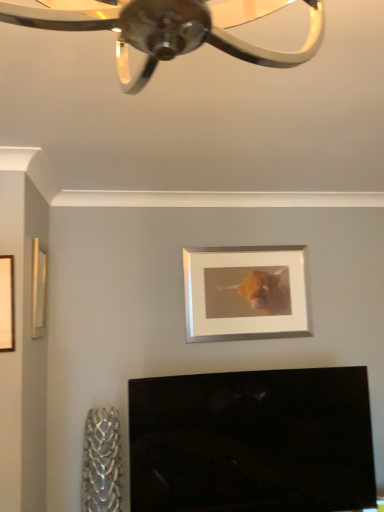
Question: Could you tell me if white matte picture frame at upper center, placed as the 3th picture frame when sorted from left to right, is turned towards wooden frame at left, acting as the 2th picture frame starting from the left?

Choices:
 (A) no
 (B) yes

Answer: (A)

Question: From the image's perspective, is white matte picture frame at upper center, the first picture frame from the right, below wooden frame at left, the 2th picture frame positioned from the front?

Choices:
 (A) no
 (B) yes

Answer: (B)

Question: Does white matte picture frame at upper center, the first picture frame from the right, appear on the right side of wooden frame at left, which is the second picture frame from right to left?

Choices:
 (A) yes
 (B) no

Answer: (A)

Question: From a real-world perspective, does white matte picture frame at upper center, placed as the 3th picture frame when sorted from left to right, stand above wooden frame at left, acting as the 2th picture frame starting from the left?

Choices:
 (A) yes
 (B) no

Answer: (B)

Question: From a real-world perspective, is white matte picture frame at upper center, which is the 1th picture frame from back to front, below wooden frame at left, the 2th picture frame positioned from the front?

Choices:
 (A) yes
 (B) no

Answer: (A)

Question: In the image, is wooden frame at left, placed as the 3th picture frame when sorted from back to front, on the left side or the right side of wooden frame at left, the 2th picture frame positioned from the front?

Choices:
 (A) left
 (B) right

Answer: (A)

Question: Relative to wooden frame at left, which is the second picture frame from right to left, is wooden frame at left, marked as the 1th picture frame in a front-to-back arrangement, in front or behind?

Choices:
 (A) behind
 (B) front

Answer: (B)

Question: Is wooden frame at left, marked as the 1th picture frame in a front-to-back arrangement, inside the boundaries of wooden frame at left, the 2th picture frame positioned from the front, or outside?

Choices:
 (A) outside
 (B) inside

Answer: (A)

Question: Is wooden frame at left, which is counted as the 1th picture frame, starting from the left, wider or thinner than wooden frame at left, which is the second picture frame from right to left?

Choices:
 (A) thin
 (B) wide

Answer: (B)

Question: Relative to white matte picture frame at upper center, placed as the 3th picture frame when sorted from left to right, is wooden frame at left, placed as the 3th picture frame when sorted from back to front, in front or behind?

Choices:
 (A) front
 (B) behind

Answer: (A)

Question: In terms of width, does wooden frame at left, placed as the 3th picture frame when sorted from back to front, look wider or thinner when compared to white matte picture frame at upper center, which is the 1th picture frame from back to front?

Choices:
 (A) wide
 (B) thin

Answer: (B)

Question: In the image, is wooden frame at left, placed as the 3th picture frame when sorted from back to front, on the left side or the right side of white matte picture frame at upper center, the first picture frame from the right?

Choices:
 (A) left
 (B) right

Answer: (A)

Question: Do you think wooden frame at left, which is counted as the 1th picture frame, starting from the left, is within white matte picture frame at upper center, which is the 1th picture frame from back to front, or outside of it?

Choices:
 (A) inside
 (B) outside

Answer: (B)

Question: Considering the positions of wooden frame at left, the 2th picture frame positioned from the front, and white matte picture frame at upper center, which is the 1th picture frame from back to front, in the image, is wooden frame at left, the 2th picture frame positioned from the front, wider or thinner than white matte picture frame at upper center, which is the 1th picture frame from back to front,?

Choices:
 (A) wide
 (B) thin

Answer: (B)

Question: From their relative heights in the image, would you say wooden frame at left, the second picture frame viewed from the back, is taller or shorter than white matte picture frame at upper center, acting as the 3th picture frame starting from the front?

Choices:
 (A) tall
 (B) short

Answer: (B)